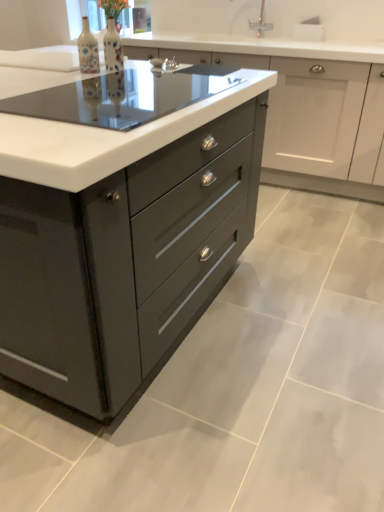
Question: From the image's perspective, does matte black cooktop at center appear higher than matte gray cabinet at center?

Choices:
 (A) yes
 (B) no

Answer: (B)

Question: From a real-world perspective, is matte black cooktop at center on top of matte gray cabinet at center?

Choices:
 (A) yes
 (B) no

Answer: (A)

Question: Can you confirm if matte black cooktop at center is wider than matte gray cabinet at center?

Choices:
 (A) yes
 (B) no

Answer: (B)

Question: Are matte black cooktop at center and matte gray cabinet at center making contact?

Choices:
 (A) no
 (B) yes

Answer: (A)

Question: From the image's perspective, is matte black cooktop at center located beneath matte gray cabinet at center?

Choices:
 (A) no
 (B) yes

Answer: (B)

Question: Is matte black cooktop at center taller than matte gray cabinet at center?

Choices:
 (A) no
 (B) yes

Answer: (A)

Question: Is matte ceramic vase at upper center, acting as the 2th bottle starting from the left, positioned beyond the bounds of matte gray cabinet at center?

Choices:
 (A) no
 (B) yes

Answer: (B)

Question: Is matte gray cabinet at center at the back of matte ceramic vase at upper center, the 1th bottle when ordered from right to left?

Choices:
 (A) no
 (B) yes

Answer: (A)

Question: From a real-world perspective, is matte ceramic vase at upper center, acting as the 2th bottle starting from the left, physically above matte gray cabinet at center?

Choices:
 (A) yes
 (B) no

Answer: (A)

Question: From a real-world perspective, is matte ceramic vase at upper center, the 1th bottle when ordered from right to left, physically below matte gray cabinet at center?

Choices:
 (A) no
 (B) yes

Answer: (A)

Question: Can you confirm if matte ceramic vase at upper center, the 1th bottle when ordered from right to left, is shorter than matte gray cabinet at center?

Choices:
 (A) no
 (B) yes

Answer: (B)

Question: Is matte ceramic vase at upper center, acting as the 2th bottle starting from the left, far from matte gray cabinet at center?

Choices:
 (A) yes
 (B) no

Answer: (A)

Question: Can you confirm if matte ceramic vase at upper center, the 1th bottle when ordered from right to left, is positioned to the left of matte black cooktop at center?

Choices:
 (A) yes
 (B) no

Answer: (A)